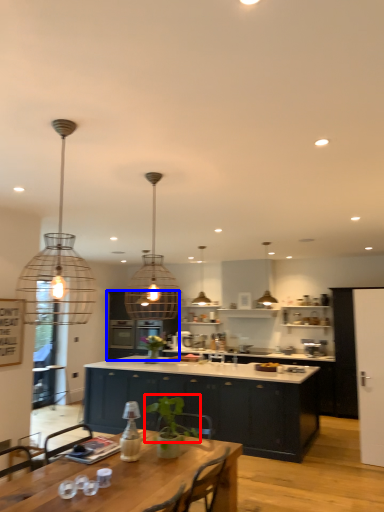
Question: Which of the following is the farthest to the observer, plant (highlighted by a red box) or cabinetry (highlighted by a blue box)?

Choices:
 (A) plant
 (B) cabinetry

Answer: (B)